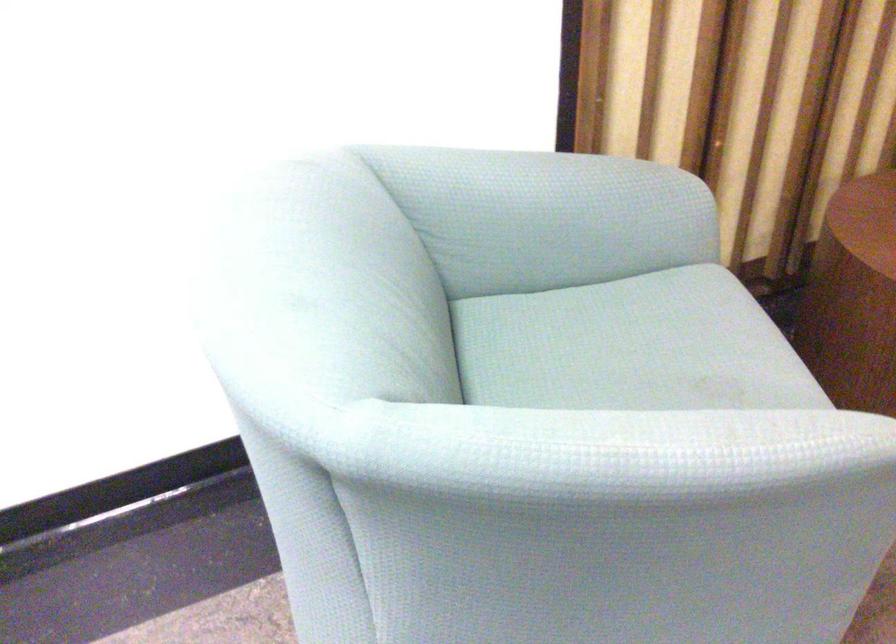
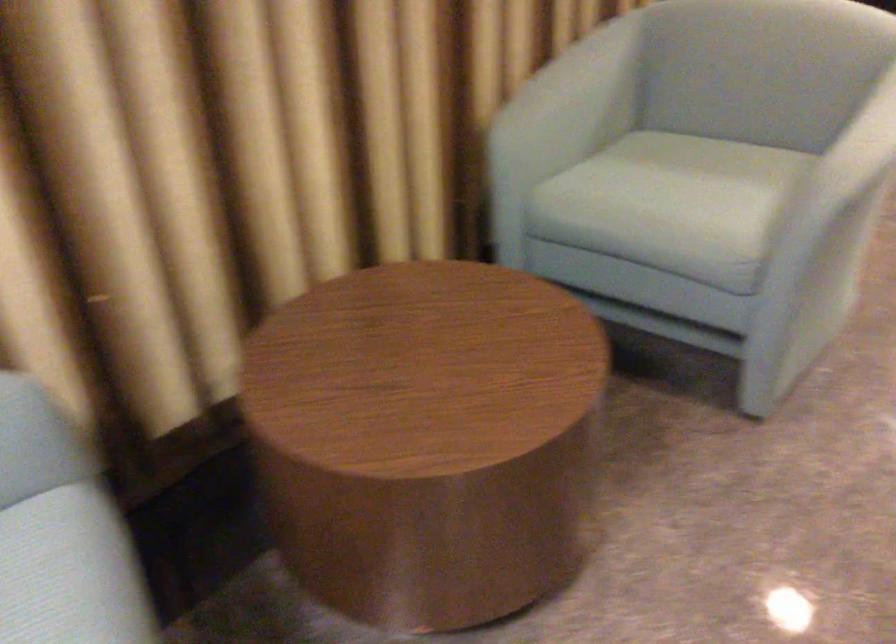
Question: The camera is either moving clockwise (left) or counter-clockwise (right) around the object. The first image is from the beginning of the video and the second image is from the end. Is the camera moving left or right when shooting the video?

Choices:
 (A) Left
 (B) Right

Answer: (A)